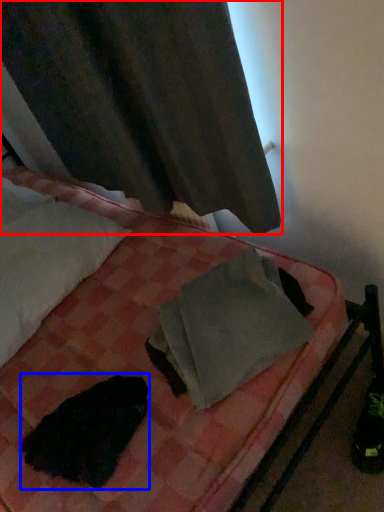
Question: Which object appears closest to the camera in this image, curtain (highlighted by a red box) or animal (highlighted by a blue box)?

Choices:
 (A) curtain
 (B) animal

Answer: (A)